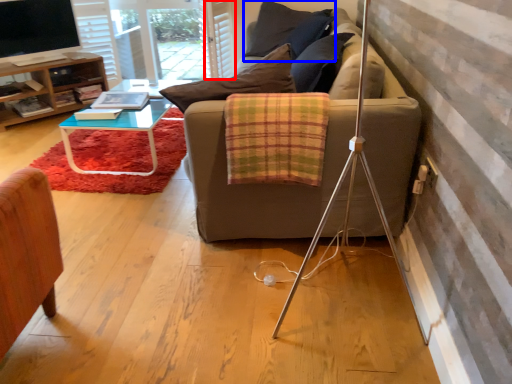
Question: Which object is further to the camera taking this photo, curtain (highlighted by a red box) or pillow (highlighted by a blue box)?

Choices:
 (A) curtain
 (B) pillow

Answer: (A)